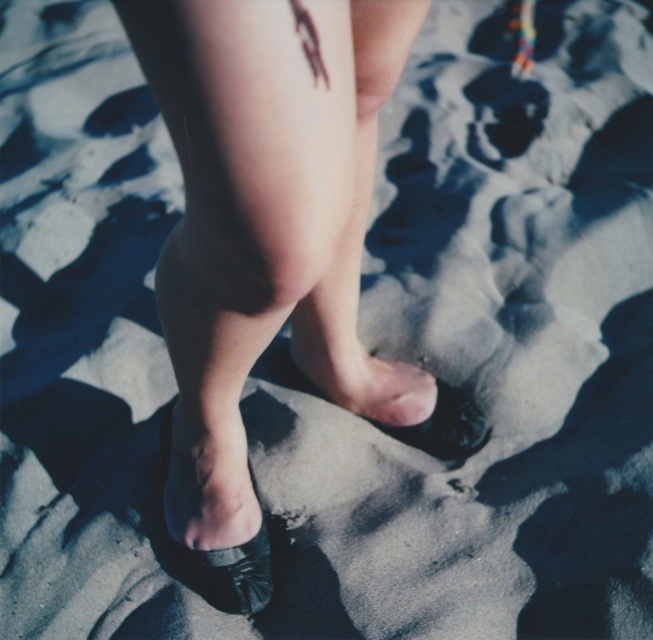
Question: Can you confirm if smooth skin leg at center is smaller than black matte sandal at center?

Choices:
 (A) yes
 (B) no

Answer: (B)

Question: In this image, where is matte black shoe at center located relative to shiny black shoe at lower center?

Choices:
 (A) above
 (B) below

Answer: (A)

Question: Which of the following is the farthest from the observer?

Choices:
 (A) (426, 436)
 (B) (165, 118)
 (C) (268, 570)
 (D) (325, 344)

Answer: (A)

Question: Estimate the real-world distances between objects in this image. Which object is closer to the smooth skin leg at center?

Choices:
 (A) matte black shoe at center
 (B) shiny black shoe at lower center

Answer: (A)

Question: Which object is closer to the camera taking this photo?

Choices:
 (A) black matte sandal at center
 (B) smooth skin leg at center
 (C) shiny black shoe at lower center
 (D) matte black shoe at center

Answer: (D)

Question: Is shiny black shoe at lower center below black matte sandal at center?

Choices:
 (A) yes
 (B) no

Answer: (A)